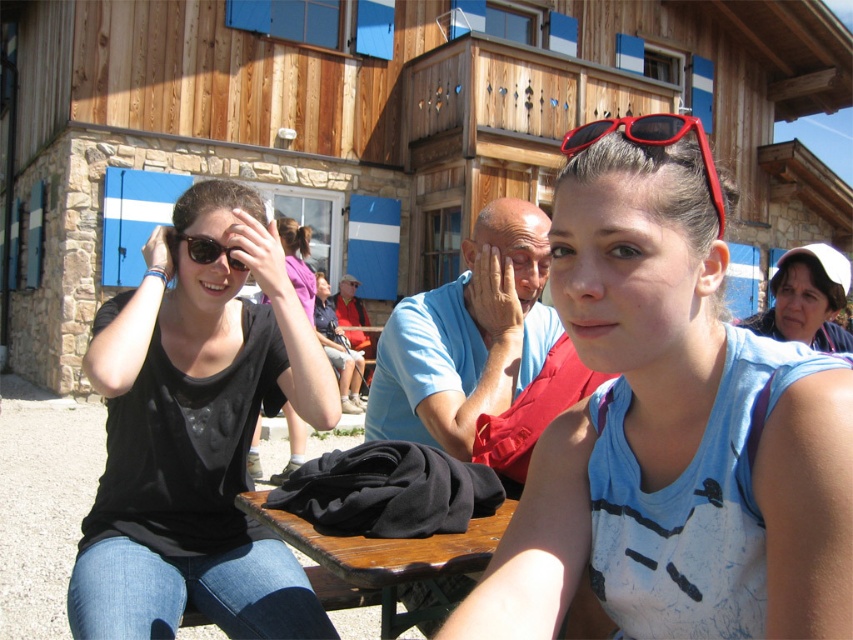
Question: Which point is closer to the camera taking this photo?

Choices:
 (A) (141, 579)
 (B) (770, 428)
 (C) (373, 552)

Answer: (B)

Question: Does blue cotton tank top at center have a greater width compared to matte white hat at upper right?

Choices:
 (A) yes
 (B) no

Answer: (B)

Question: Which of the following is the farthest from the observer?

Choices:
 (A) matte black sunglasses at upper left
 (B) red plastic sunglasses at upper center

Answer: (A)

Question: Is black matte shirt at left to the right of matte black sunglasses at upper left from the viewer's perspective?

Choices:
 (A) yes
 (B) no

Answer: (B)

Question: Observing the image, what is the correct spatial positioning of red plastic sunglasses at upper center in reference to matte black sunglasses at upper left?

Choices:
 (A) below
 (B) above

Answer: (B)

Question: Which of the following is the closest to the observer?

Choices:
 (A) (142, 612)
 (B) (634, 132)
 (C) (221, 246)

Answer: (B)